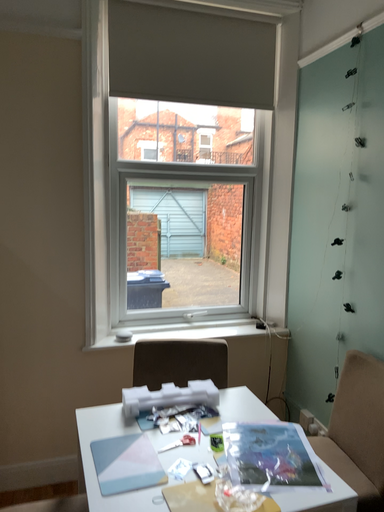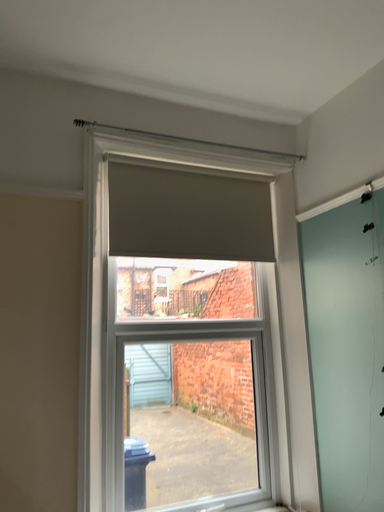
Question: How did the camera likely rotate when shooting the video?

Choices:
 (A) rotated downward
 (B) rotated upward

Answer: (B)